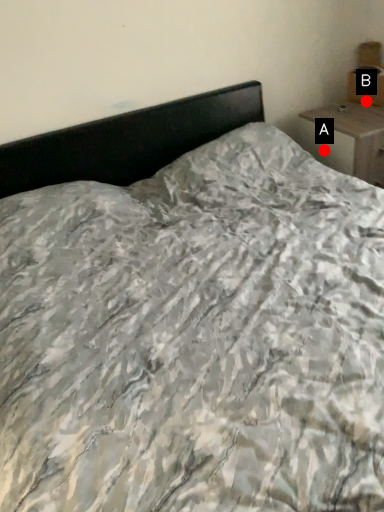
Question: Two points are circled on the image, labeled by A and B beside each circle. Which point is closer to the camera taking this photo?

Choices:
 (A) A is closer
 (B) B is closer

Answer: (B)